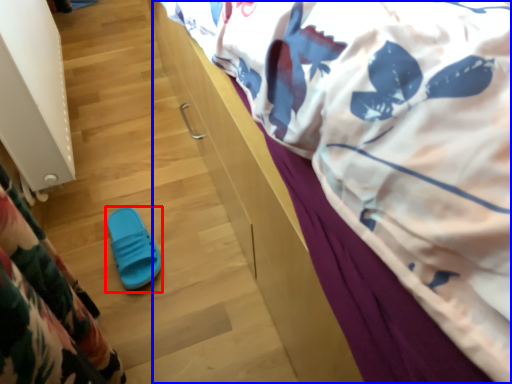
Question: Among these objects, which one is nearest to the camera, footwear (highlighted by a red box) or bed (highlighted by a blue box)?

Choices:
 (A) footwear
 (B) bed

Answer: (B)